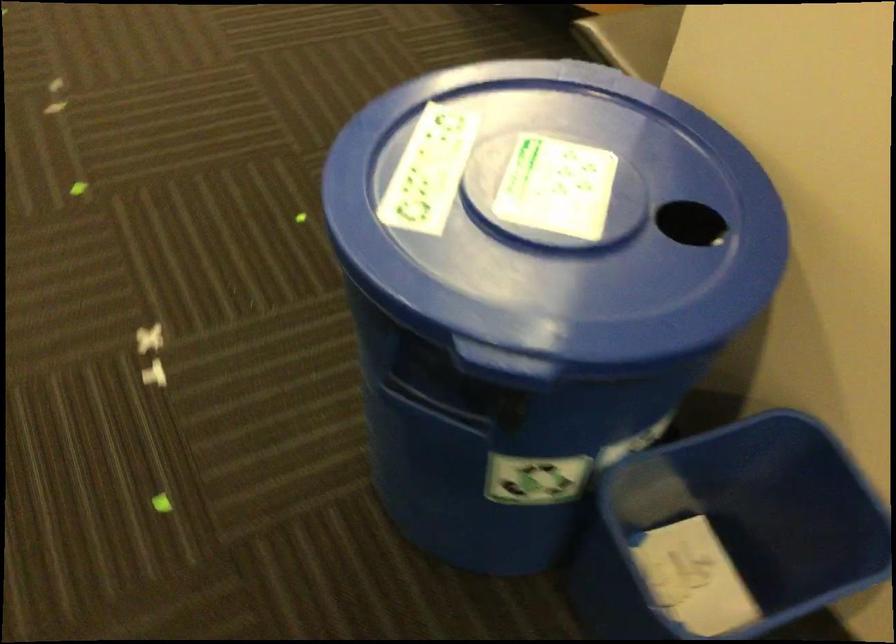
The location [556,187] corresponds to which object?

It refers to a piece of paper.